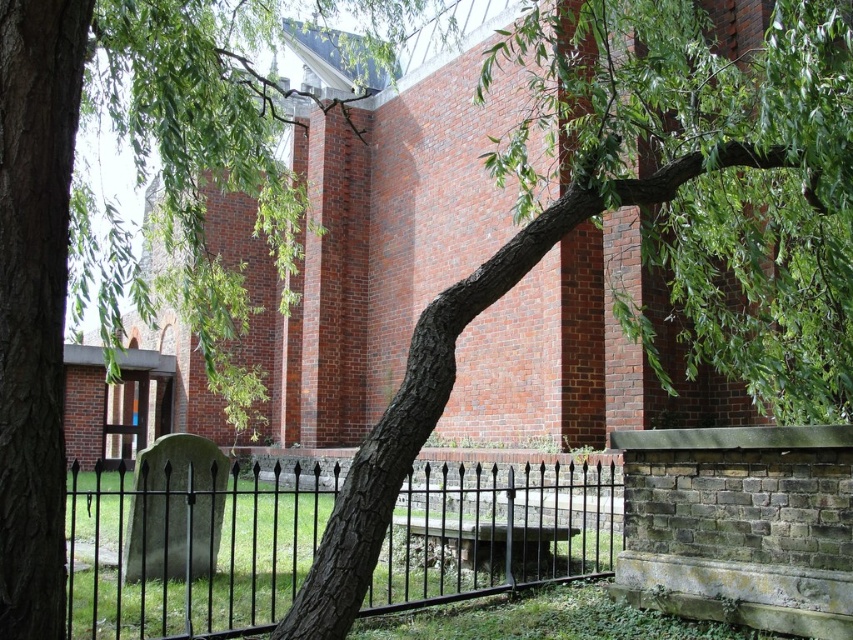
Does smooth bark tree at center come behind black wrought iron fence at center?

No, it is not.

Is point (33, 346) positioned before point (410, 605)?

Yes, point (33, 346) is closer to viewer.

Find the location of `smooth bark tree at center`. smooth bark tree at center is located at coordinates (112, 221).

Who is lower down, green leafy branch at center or black wrought iron fence at center?

black wrought iron fence at center

Measure the distance between green leafy branch at center and black wrought iron fence at center.

green leafy branch at center and black wrought iron fence at center are 15.26 feet apart from each other.

Locate an element on the screen. green leafy branch at center is located at coordinates (648, 225).

Based on the photo, is green leafy branch at center shorter than smooth bark tree at center?

Indeed, green leafy branch at center has a lesser height compared to smooth bark tree at center.

Between green leafy branch at center and smooth bark tree at center, which one is positioned higher?

Positioned higher is smooth bark tree at center.

The width and height of the screenshot is (853, 640). What do you see at coordinates (648, 225) in the screenshot?
I see `green leafy branch at center` at bounding box center [648, 225].

At what (x,y) coordinates should I click in order to perform the action: click on green leafy branch at center. Please return your answer as a coordinate pair (x, y). Image resolution: width=853 pixels, height=640 pixels. Looking at the image, I should click on (648, 225).